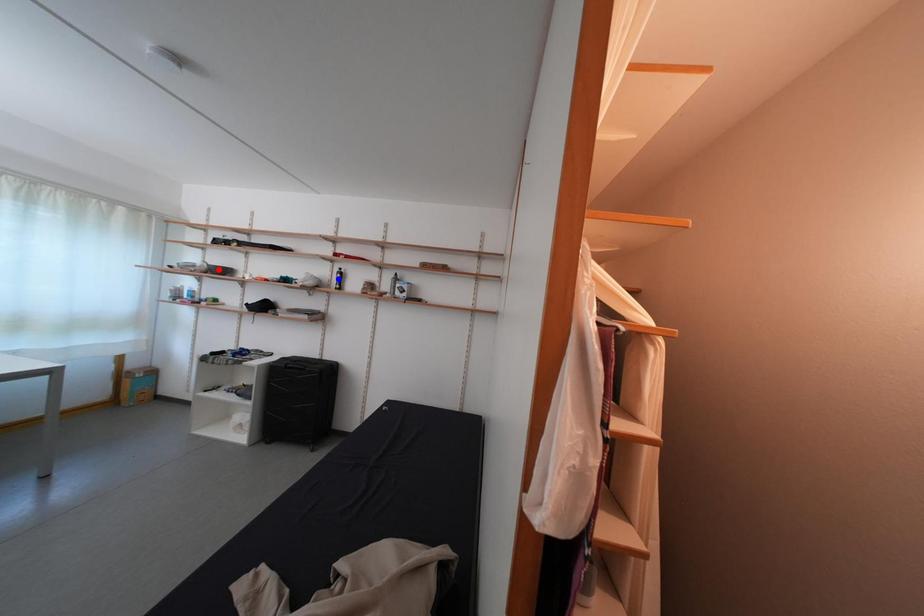
Question: In the image, two points are highlighted. Which point is nearer to the camera? Reply with the corresponding letter.

Choices:
 (A) blue point
 (B) red point

Answer: (A)